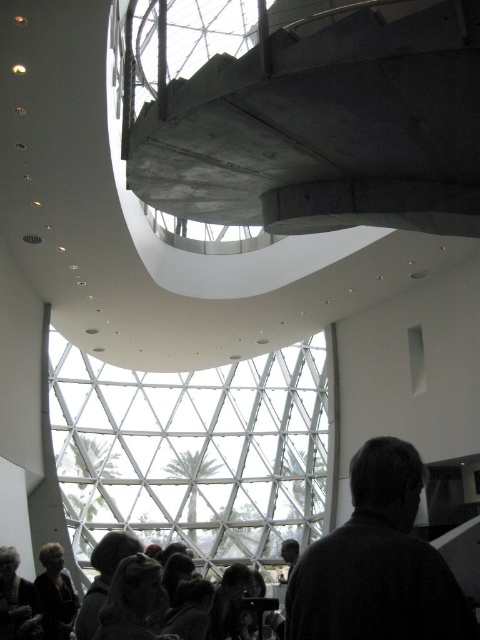
Between point (152, 138) and point (1, 620), which one is positioned behind?

The point (1, 620) is more distant.

Locate an element on the screen. concrete/stone staircase at upper center is located at coordinates (322, 124).

Is point (240, 115) in front of point (27, 596)?

Yes, point (240, 115) is closer to viewer.

What are the coordinates of `concrete/stone staircase at upper center` in the screenshot? It's located at (322, 124).

Can you confirm if dark gray hair at lower left is positioned to the left of dark gray sweater at lower left?

Indeed, dark gray hair at lower left is positioned on the left side of dark gray sweater at lower left.

In the scene shown: Does dark gray hair at lower left appear under dark gray sweater at lower left?

No.

The image size is (480, 640). I want to click on dark gray hair at lower left, so click(16, 600).

The width and height of the screenshot is (480, 640). What do you see at coordinates (322, 124) in the screenshot?
I see `concrete/stone staircase at upper center` at bounding box center [322, 124].

At what (x,y) coordinates should I click in order to perform the action: click on concrete/stone staircase at upper center. Please return your answer as a coordinate pair (x, y). This screenshot has height=640, width=480. Looking at the image, I should click on (322, 124).